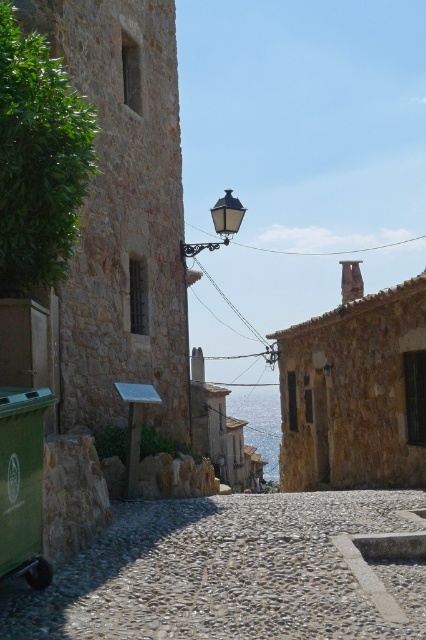
You are a tourist visiting this village and want to take a photo of the blue water at center and the black glass streetlamp at upper center. Which object will occupy more space in your photo?

The blue water at center is larger in size than the black glass streetlamp at upper center, so it will occupy more space in the photo.

You are a delivery person trying to navigate a narrow alley in a European village. You see the gray gravel alley at center and the black glass streetlamp at upper center. Which object is positioned higher from the ground?

The black glass streetlamp at upper center is positioned higher from the ground than the gray gravel alley at center.

You are standing at the point marked by the coordinates point (259, 422) in the image. Based on the scene description, what would you most likely see directly in front of you?

The coordinates point (259, 422) correspond to blue water at center, so you would most likely see blue water directly in front of you.